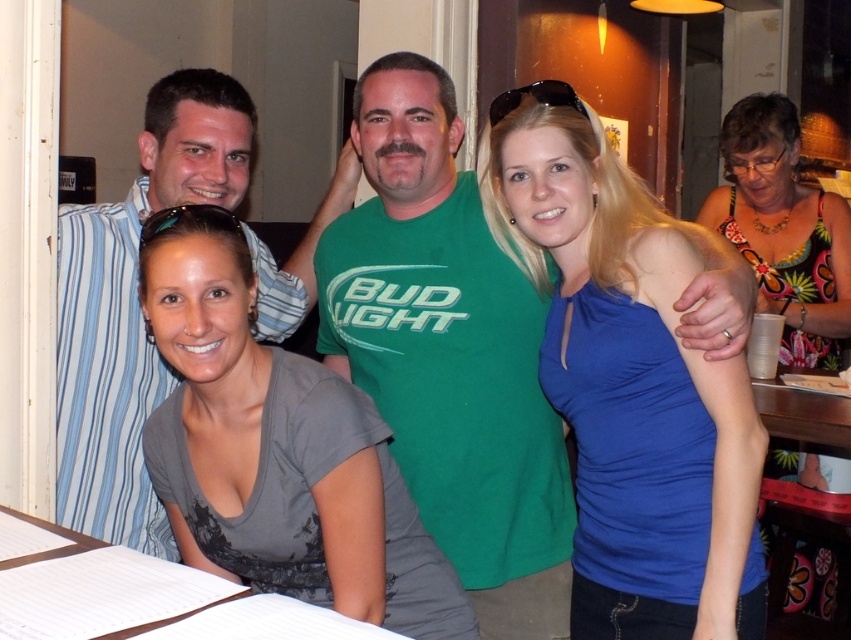
You are a photographer standing at the point marked as point (533, 276). You want to take a photo of the two men in the group. The minimum distance required for your camera lens to focus properly is 1.5 meters. Will you be able to capture both men clearly in focus at this distance?

The two men are 1.62 meters apart, which is greater than the minimum focusing distance of 1.5 meters. Therefore, you can capture both men clearly in focus at this distance.

You are at a party and want to find the blue fabric shirt at center. Which direction should you look relative to the gray fabric shirt at lower left?

The blue fabric shirt at center is to the right of the gray fabric shirt at lower left, so you should look to the right of the gray fabric shirt at lower left to find it.